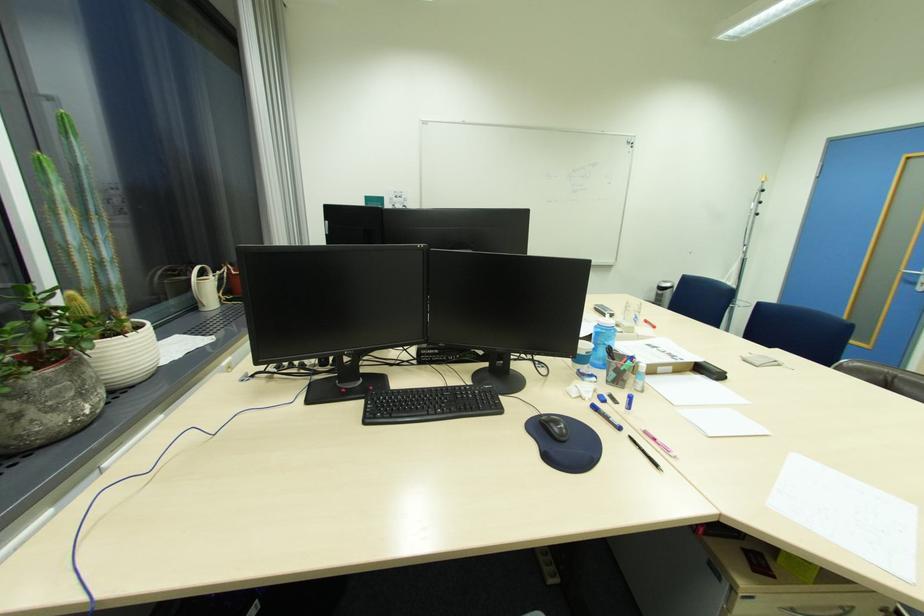
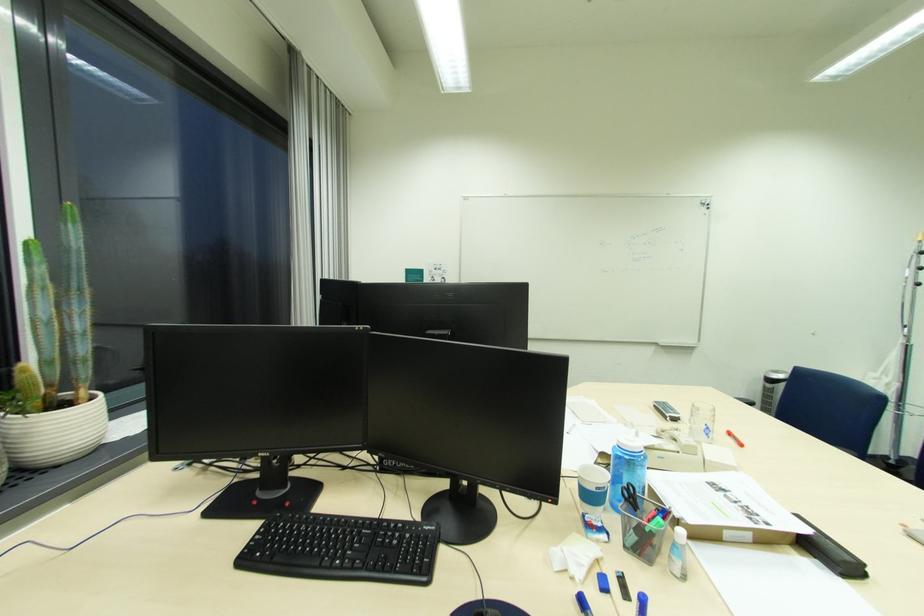
Where in the second image is the point corresponding to point 624,403 from the first image?

(636, 601)